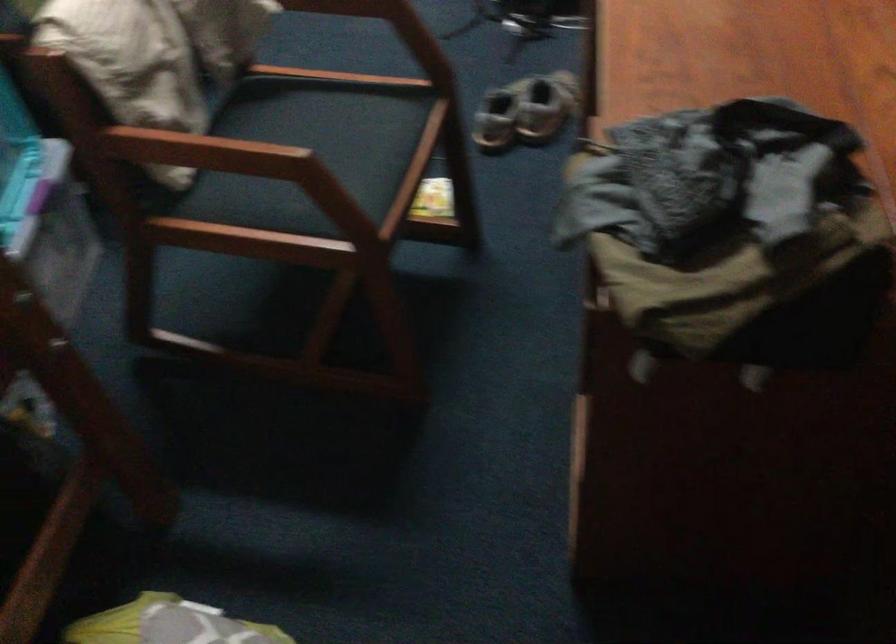
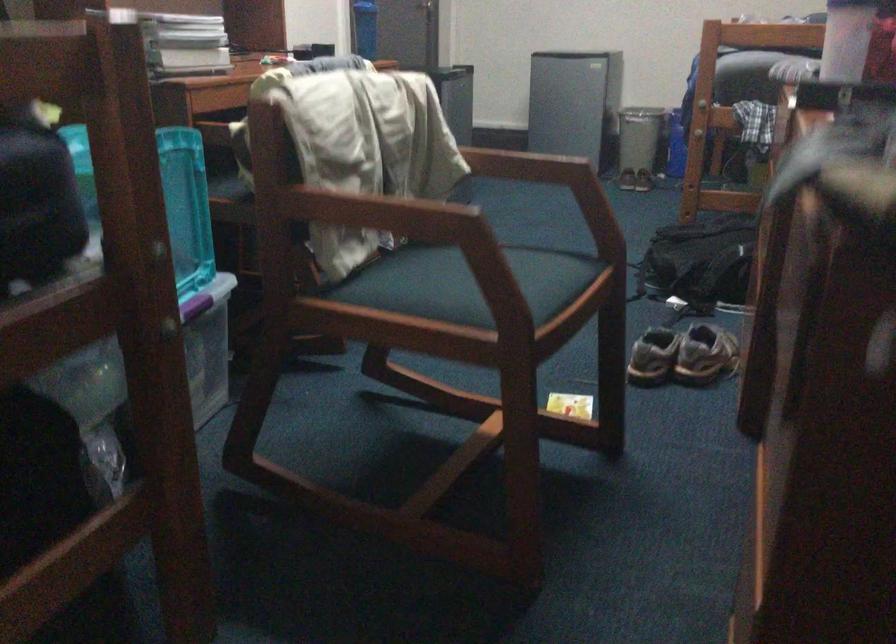
In the second image, find the point that corresponds to (264,152) in the first image.

(436, 210)